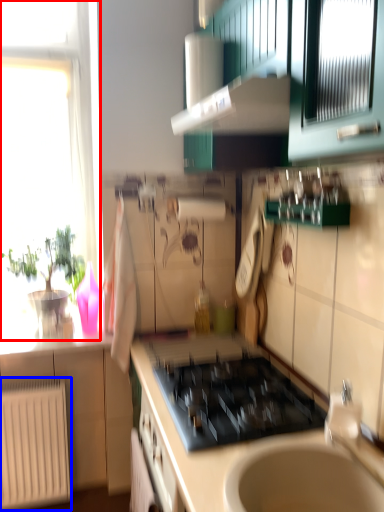
Question: Among these objects, which one is farthest to the camera, window (highlighted by a red box) or radiator (highlighted by a blue box)?

Choices:
 (A) window
 (B) radiator

Answer: (A)